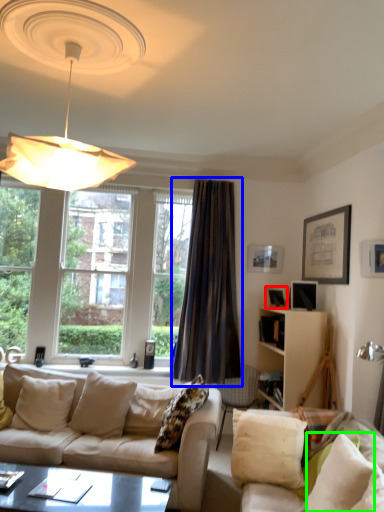
Question: Which object is the farthest from picture frame (highlighted by a red box)? Choose among these: curtain (highlighted by a blue box) or pillow (highlighted by a green box).

Choices:
 (A) curtain
 (B) pillow

Answer: (B)